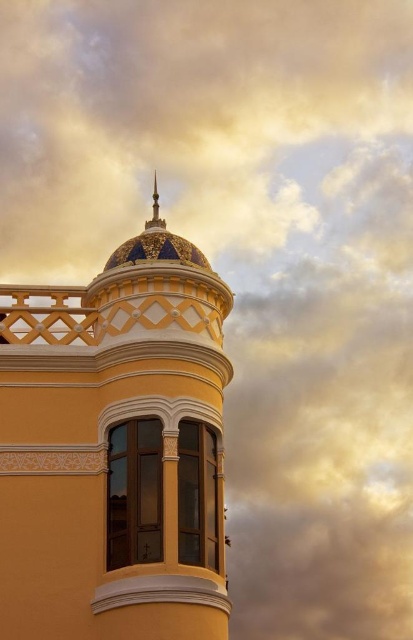
You are standing in front of the building and want to take a photo of the matte yellow bell tower at center and the gold metallic spire at upper center. Which object will appear larger in your photo?

The matte yellow bell tower at center will appear larger in your photo because it is closer to you than the gold metallic spire at upper center.

You are an architect examining the building design. You need to determine the spatial relationship between the matte yellow bell tower at center and the gold metallic spire at upper center. Which object is located to the left of the other?

The matte yellow bell tower at center is positioned on the right side of gold metallic spire at upper center, meaning the gold metallic spire at upper center is to the left of the matte yellow bell tower at center.